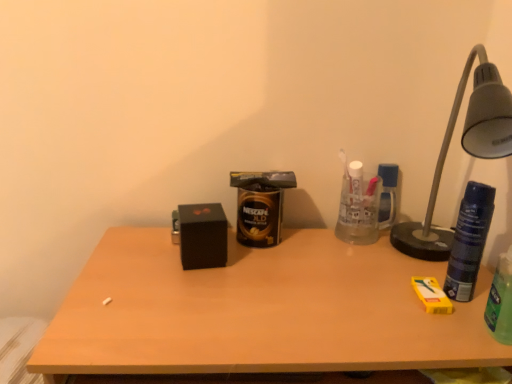
Question: Is metallic gray lamp at right facing away from wooden desk at center?

Choices:
 (A) no
 (B) yes

Answer: (A)

Question: Can you confirm if metallic gray lamp at right is smaller than wooden desk at center?

Choices:
 (A) no
 (B) yes

Answer: (B)

Question: From the image's perspective, is metallic gray lamp at right below wooden desk at center?

Choices:
 (A) yes
 (B) no

Answer: (B)

Question: From a real-world perspective, is metallic gray lamp at right physically below wooden desk at center?

Choices:
 (A) no
 (B) yes

Answer: (A)

Question: Does metallic gray lamp at right come behind wooden desk at center?

Choices:
 (A) no
 (B) yes

Answer: (A)

Question: Is blue textured can at right, the 2th beverage in the right-to-left sequence, bigger or smaller than black matte box at center?

Choices:
 (A) small
 (B) big

Answer: (A)

Question: Based on their positions, is blue textured can at right, arranged as the 2th beverage when viewed from the left, located to the left or right of black matte box at center?

Choices:
 (A) right
 (B) left

Answer: (A)

Question: Looking at their shapes, would you say blue textured can at right, which appears as the second beverage when viewed from the back, is wider or thinner than black matte box at center?

Choices:
 (A) wide
 (B) thin

Answer: (B)

Question: From the image's perspective, relative to black matte box at center, is blue textured can at right, the 2th beverage in the right-to-left sequence, above or below?

Choices:
 (A) below
 (B) above

Answer: (B)

Question: Is point (468, 185) closer or farther from the camera than point (379, 314)?

Choices:
 (A) closer
 (B) farther

Answer: (B)

Question: In terms of size, does blue textured can at right, arranged as the 2th beverage when viewed from the left, appear bigger or smaller than wooden desk at center?

Choices:
 (A) small
 (B) big

Answer: (A)

Question: From a real-world perspective, is blue textured can at right, arranged as the 2th beverage when viewed from the left, physically located above or below wooden desk at center?

Choices:
 (A) above
 (B) below

Answer: (A)

Question: Based on their positions, is blue textured can at right, which is the 2th beverage from front to back, located to the left or right of wooden desk at center?

Choices:
 (A) right
 (B) left

Answer: (A)

Question: Relative to black matte box at center, is gold metallic can at center, marked as the third beverage in a right-to-left arrangement, in front or behind?

Choices:
 (A) front
 (B) behind

Answer: (B)

Question: Based on their positions, is gold metallic can at center, arranged as the third beverage when viewed from the front, located to the left or right of black matte box at center?

Choices:
 (A) left
 (B) right

Answer: (B)